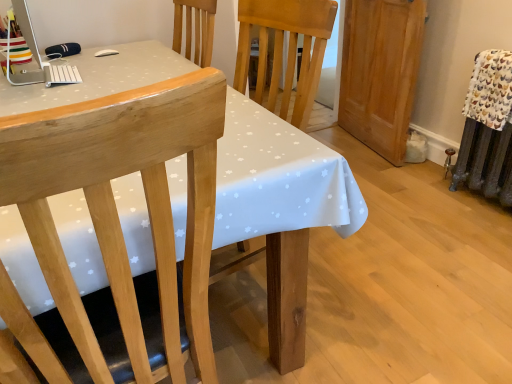
Question: Considering the relative sizes of light brown wood armoire at right and white dotted fabric at center in the image provided, is light brown wood armoire at right wider than white dotted fabric at center?

Choices:
 (A) yes
 (B) no

Answer: (B)

Question: From a real-world perspective, is light brown wood armoire at right positioned under white dotted fabric at center based on gravity?

Choices:
 (A) yes
 (B) no

Answer: (B)

Question: Can you see light brown wood armoire at right touching white dotted fabric at center?

Choices:
 (A) no
 (B) yes

Answer: (A)

Question: Is light brown wood armoire at right at the right side of white dotted fabric at center?

Choices:
 (A) yes
 (B) no

Answer: (A)

Question: Is light brown wood armoire at right far away from white dotted fabric at center?

Choices:
 (A) yes
 (B) no

Answer: (A)

Question: From the image's perspective, would you say light brown wood armoire at right is shown under white dotted fabric at center?

Choices:
 (A) yes
 (B) no

Answer: (B)

Question: Is light brown wood armoire at right positioned behind white plastic desktop computer at upper left?

Choices:
 (A) no
 (B) yes

Answer: (B)

Question: Could you tell me if light brown wood armoire at right is turned towards white plastic desktop computer at upper left?

Choices:
 (A) no
 (B) yes

Answer: (B)

Question: From a real-world perspective, does light brown wood armoire at right stand above white plastic desktop computer at upper left?

Choices:
 (A) yes
 (B) no

Answer: (B)

Question: Considering the relative sizes of light brown wood armoire at right and white plastic desktop computer at upper left in the image provided, is light brown wood armoire at right shorter than white plastic desktop computer at upper left?

Choices:
 (A) yes
 (B) no

Answer: (B)

Question: From a real-world perspective, is light brown wood armoire at right physically below white plastic desktop computer at upper left?

Choices:
 (A) yes
 (B) no

Answer: (A)

Question: From the image's perspective, would you say light brown wood armoire at right is shown under white plastic desktop computer at upper left?

Choices:
 (A) yes
 (B) no

Answer: (B)

Question: From the image's perspective, is white dotted fabric at center on natural wood chair at left?

Choices:
 (A) no
 (B) yes

Answer: (B)